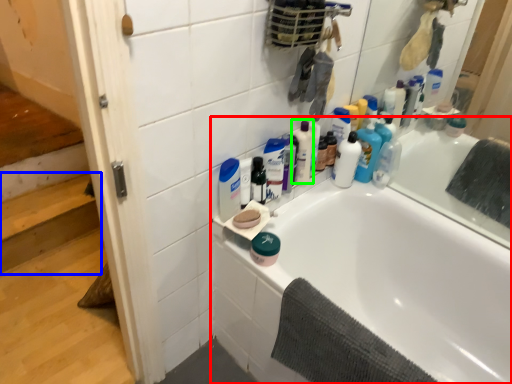
Question: Which is nearer to the bathtub (highlighted by a red box)? stairwell (highlighted by a blue box) or cleaning product (highlighted by a green box).

Choices:
 (A) stairwell
 (B) cleaning product

Answer: (B)